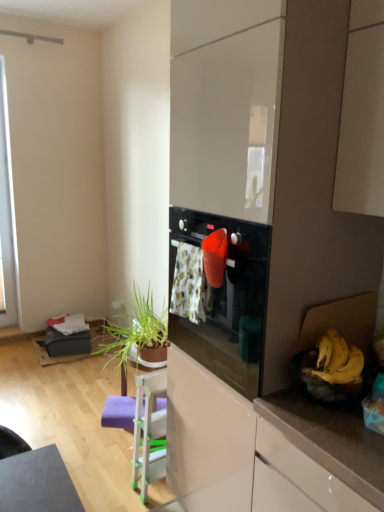
This screenshot has width=384, height=512. Identify the location of free spot below white plastic chair at lower center (from a real-world perspective). (154, 492).